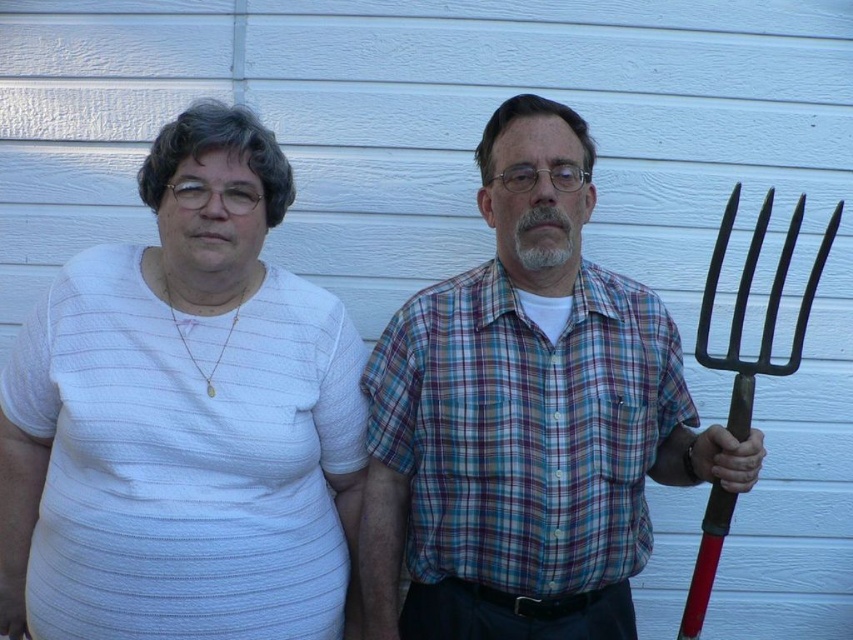
Which is more to the right, matte plaid shirt at center or red metal pitchfork at right?

From the viewer's perspective, red metal pitchfork at right appears more on the right side.

The height and width of the screenshot is (640, 853). Identify the location of matte plaid shirt at center. (526, 417).

Who is more forward, (666, 314) or (778, 285)?

Positioned in front is point (778, 285).

At what (x,y) coordinates should I click in order to perform the action: click on matte plaid shirt at center. Please return your answer as a coordinate pair (x, y). Looking at the image, I should click on (526, 417).

Does white striped shirt at left have a lesser height compared to matte plaid shirt at center?

Yes.

At what (x,y) coordinates should I click in order to perform the action: click on white striped shirt at left. Please return your answer as a coordinate pair (x, y). This screenshot has width=853, height=640. Looking at the image, I should click on click(183, 419).

Where is `white striped shirt at left`? The width and height of the screenshot is (853, 640). white striped shirt at left is located at coordinates (183, 419).

Is point (50, 365) less distant than point (715, 483)?

No.

Is white striped shirt at left thinner than red metal pitchfork at right?

No, white striped shirt at left is not thinner than red metal pitchfork at right.

Find the location of a particular element. This screenshot has width=853, height=640. white striped shirt at left is located at coordinates (183, 419).